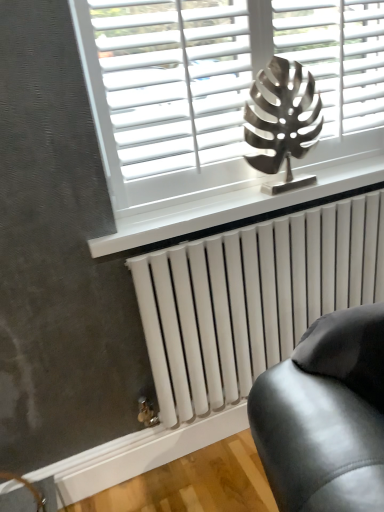
At what (x,y) coordinates should I click in order to perform the action: click on blank space above white metallic radiator at lower center (from a real-world perspective). Please return your answer as a coordinate pair (x, y). Looking at the image, I should click on click(x=263, y=219).